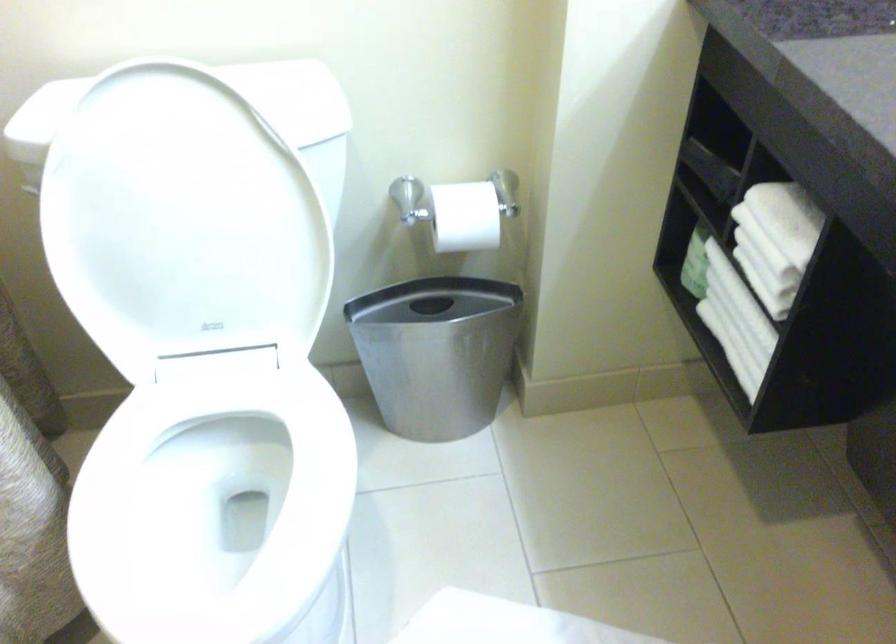
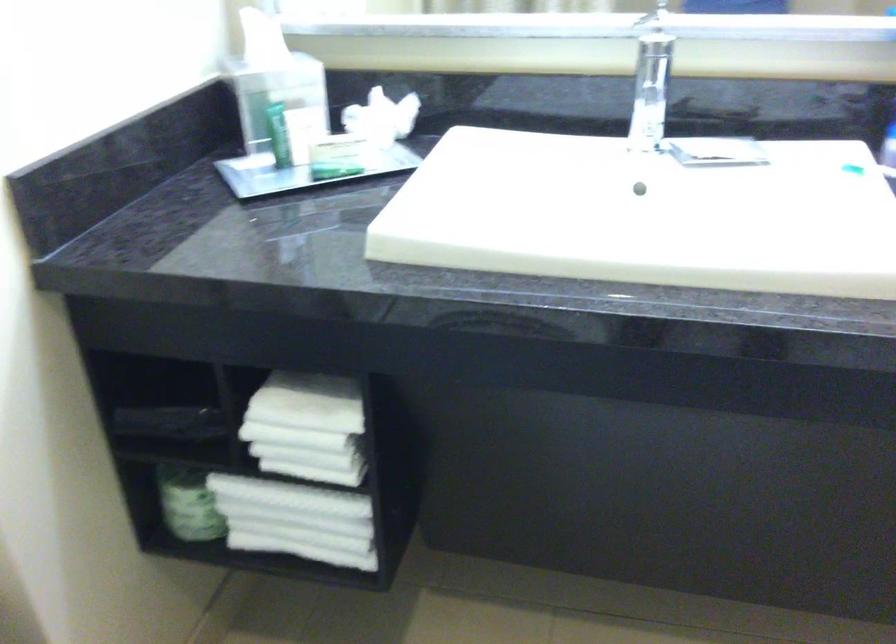
Locate, in the second image, the point that corresponds to point 768,234 in the first image.

(307, 428)